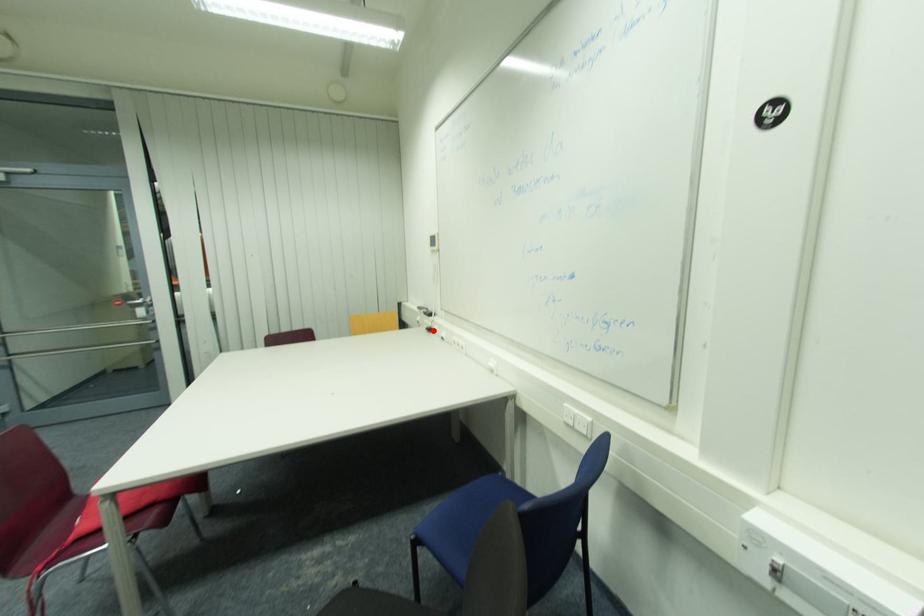
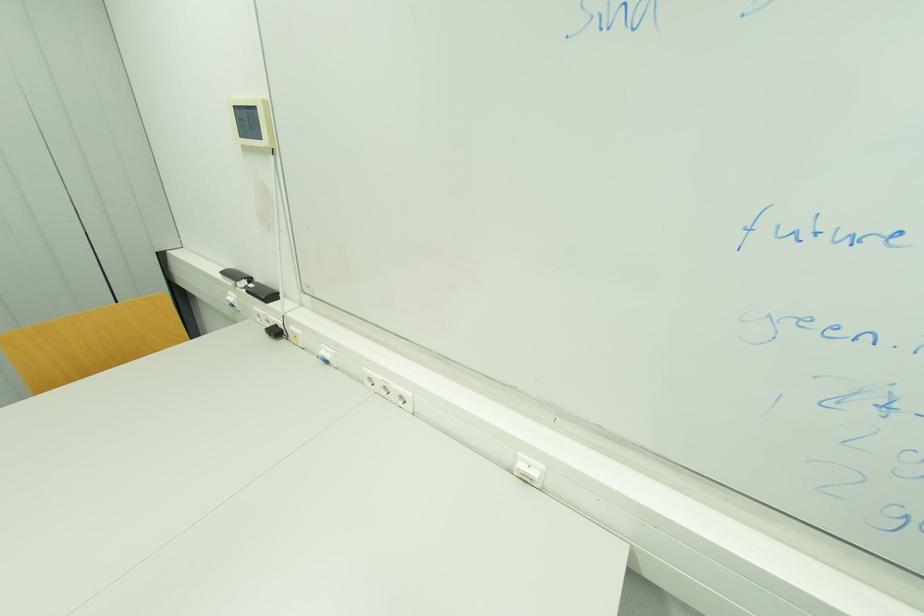
The point at the highlighted location is marked in the first image. Where is the corresponding point in the second image?

(281, 333)